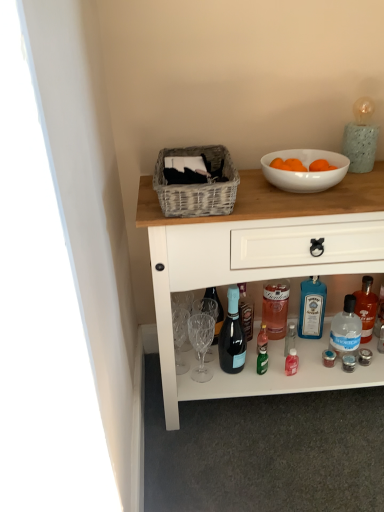
Question: Should I look upward or downward to see clear plastic bottle at lower right, the first bottle positioned from the right?

Choices:
 (A) up
 (B) down

Answer: (B)

Question: Does white glossy bowl at upper right have a greater width compared to blue glass bottle at lower center, marked as the 1th bottle in a left-to-right arrangement?

Choices:
 (A) yes
 (B) no

Answer: (A)

Question: Is white glossy bowl at upper right at the right side of blue glass bottle at lower center, marked as the 1th bottle in a left-to-right arrangement?

Choices:
 (A) no
 (B) yes

Answer: (A)

Question: Are white glossy bowl at upper right and blue glass bottle at lower center, marked as the 1th bottle in a left-to-right arrangement, located far from each other?

Choices:
 (A) no
 (B) yes

Answer: (A)

Question: From the image's perspective, is white glossy bowl at upper right located above blue glass bottle at lower center, marked as the 1th bottle in a left-to-right arrangement?

Choices:
 (A) no
 (B) yes

Answer: (B)

Question: Is white glossy bowl at upper right shorter than blue glass bottle at lower center, the third bottle from the right?

Choices:
 (A) no
 (B) yes

Answer: (B)

Question: Is white glossy bowl at upper right smaller than blue glass bottle at lower center, marked as the 1th bottle in a left-to-right arrangement?

Choices:
 (A) yes
 (B) no

Answer: (A)

Question: Does woven gray picnic basket at upper center have a larger size compared to transparent plastic bottle at lower right, the 2th bottle in the right-to-left sequence?

Choices:
 (A) yes
 (B) no

Answer: (A)

Question: Does woven gray picnic basket at upper center have a greater height compared to transparent plastic bottle at lower right, the 2th bottle in the right-to-left sequence?

Choices:
 (A) yes
 (B) no

Answer: (B)

Question: Can you see woven gray picnic basket at upper center touching transparent plastic bottle at lower right, the 2th bottle in the right-to-left sequence?

Choices:
 (A) yes
 (B) no

Answer: (B)

Question: From the image's perspective, is woven gray picnic basket at upper center located beneath transparent plastic bottle at lower right, the second bottle viewed from the left?

Choices:
 (A) no
 (B) yes

Answer: (A)

Question: Can you confirm if woven gray picnic basket at upper center is thinner than transparent plastic bottle at lower right, the second bottle viewed from the left?

Choices:
 (A) no
 (B) yes

Answer: (A)

Question: Is woven gray picnic basket at upper center shorter than transparent plastic bottle at lower right, the 2th bottle in the right-to-left sequence?

Choices:
 (A) yes
 (B) no

Answer: (A)

Question: Is white glossy bowl at upper right looking in the opposite direction of transparent plastic bottle at lower right, the 2th bottle in the right-to-left sequence?

Choices:
 (A) no
 (B) yes

Answer: (A)